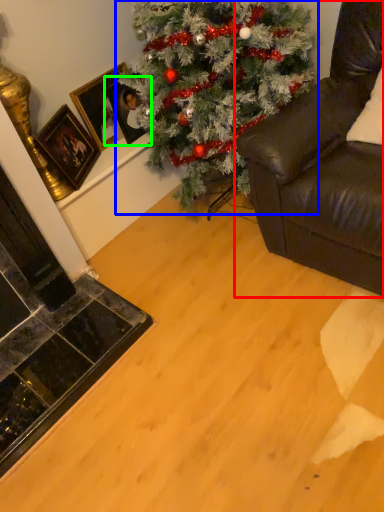
Question: Considering the real-world distances, which object is closest to studio couch (highlighted by a red box)? christmas tree (highlighted by a blue box) or picture frame (highlighted by a green box).

Choices:
 (A) christmas tree
 (B) picture frame

Answer: (A)